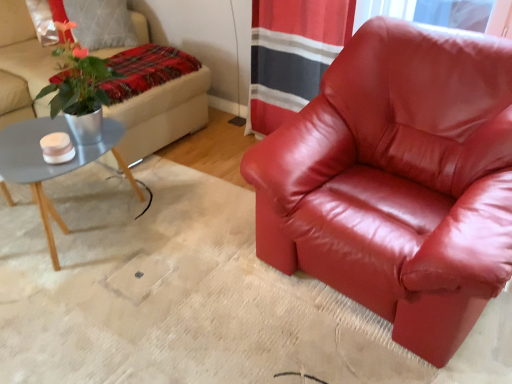
Where is `vacant area that lies to the right of matte gray coffee table at left`? vacant area that lies to the right of matte gray coffee table at left is located at coordinates click(x=183, y=232).